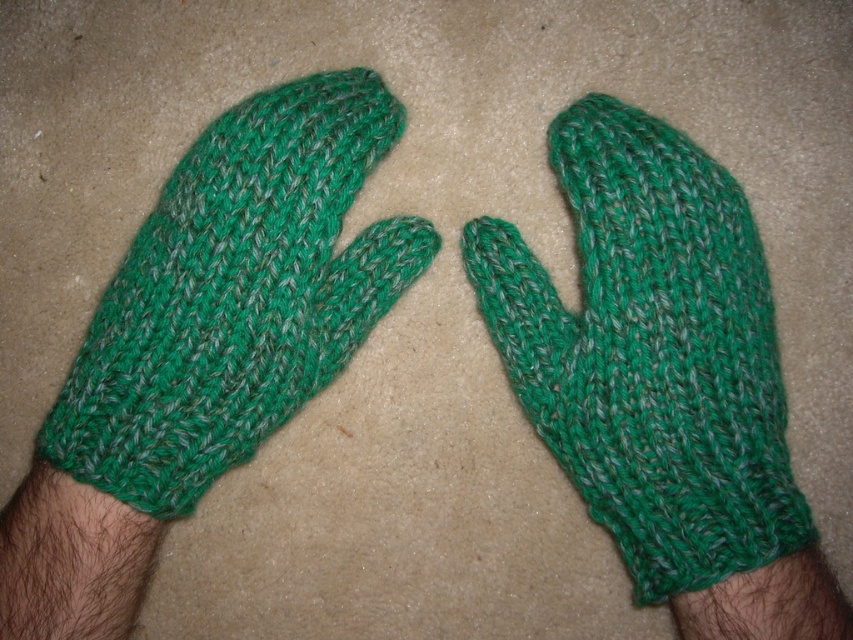
Please describe the 2D location of the green knitted mitten at center in the image using coordinates. The coordinates should be in the range of 0 to 1, where the origin is at the bottom left corner of the image. The x and y axes are defined as follows. The x axis increases to the right, and the y axis increases upwards. The coordinates are normalized such that the entire image is represented by a unit square. The question must mention the origin and axes definitions. The answer must provide the exact x and.

The 2D location of the green knitted mitten at center is at point 0.550 in the x coordinate and 0.763 in the y coordinate. Since the origin is at the bottom left corner, this means the mitten is positioned 55.0 percent from the left edge and 76.3 percent from the bottom edge of the image. The coordinates are normalized within the unit square, so they range from 0 to 1.

You are trying to place a ruler horizontally between the green knitted mitten at center and the green knitted mitten at left. The ruler is 10 inches long. Will the ruler fit entirely between them?

The distance between the green knitted mitten at center and the green knitted mitten at left is 10.55 inches, which is longer than the ruler. Therefore, the ruler will fit entirely between them.